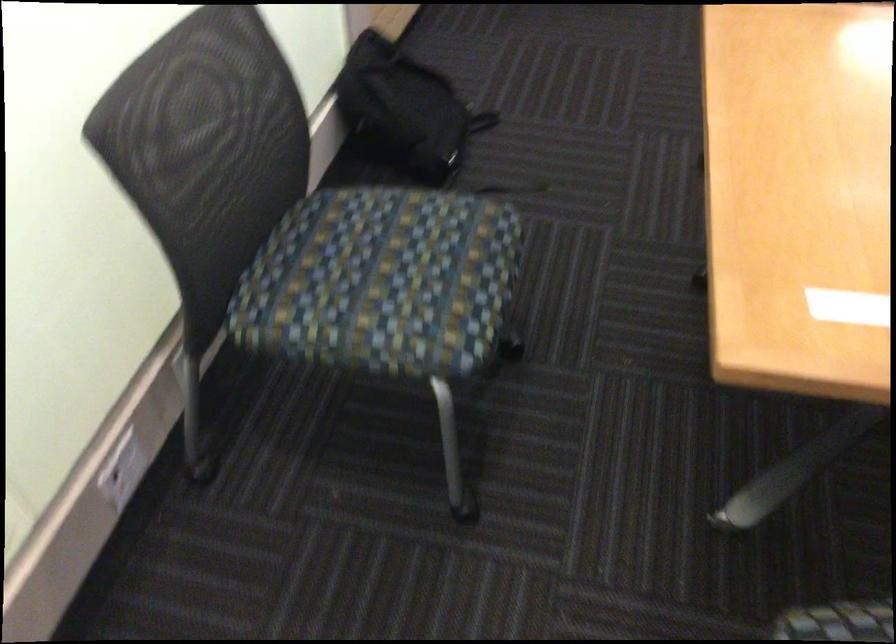
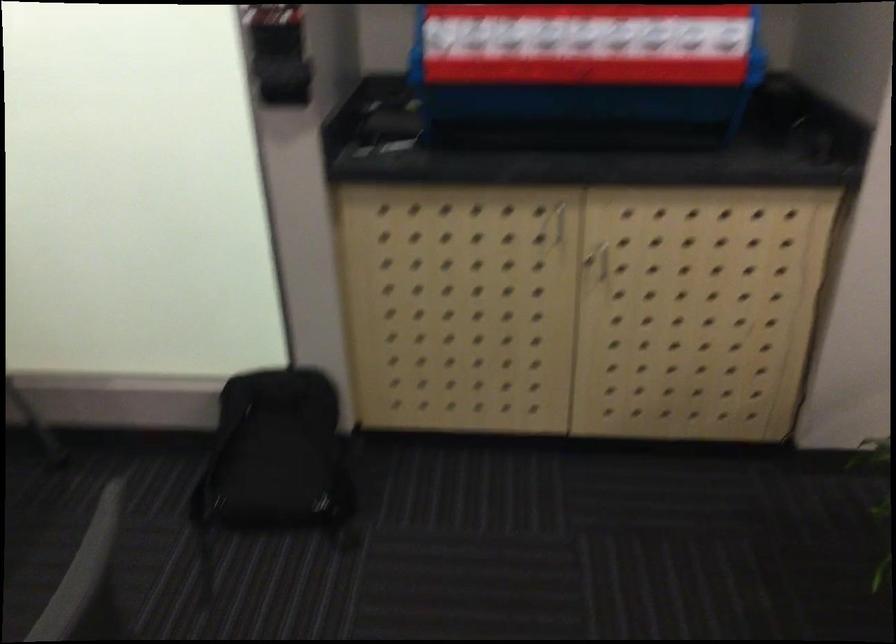
Locate, in the second image, the point that corresponds to (428,86) in the first image.

(277, 455)